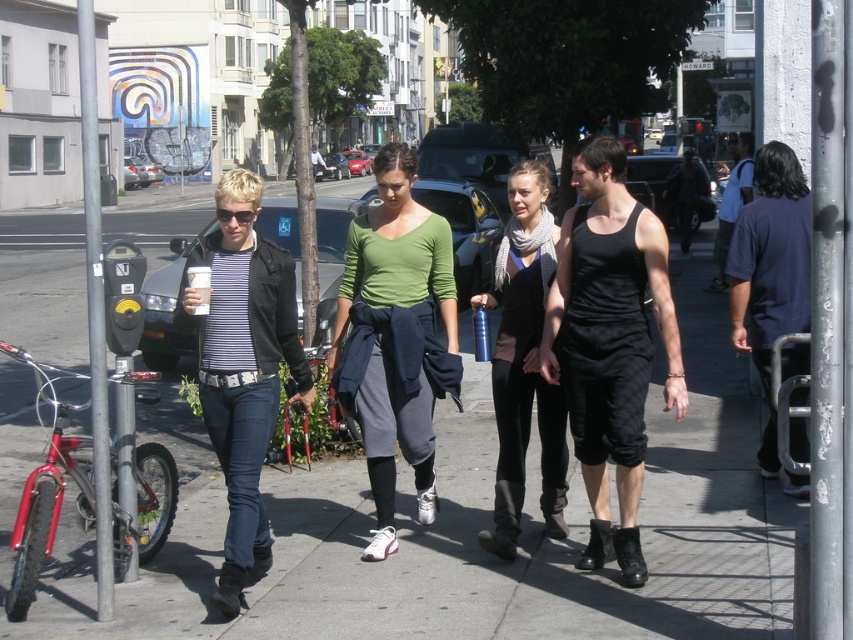
Is striped fabric shirt at left shorter than matte black vest at center?

Indeed, striped fabric shirt at left has a lesser height compared to matte black vest at center.

Is striped fabric shirt at left thinner than matte black vest at center?

Indeed, striped fabric shirt at left has a lesser width compared to matte black vest at center.

Who is more distant from viewer, (200, 260) or (543, 504)?

The point (543, 504) is behind.

Image resolution: width=853 pixels, height=640 pixels. Find the location of `striped fabric shirt at left`. striped fabric shirt at left is located at coordinates (242, 365).

Is black cotton tank top at center thinner than black tank top at center?

Yes, black cotton tank top at center is thinner than black tank top at center.

Is black cotton tank top at center below black tank top at center?

Yes.

The height and width of the screenshot is (640, 853). Find the location of `black cotton tank top at center`. black cotton tank top at center is located at coordinates (608, 342).

Can you confirm if gray concrete sidewalk at center is positioned above black tank top at center?

Actually, gray concrete sidewalk at center is below black tank top at center.

Does gray concrete sidewalk at center have a smaller size compared to black tank top at center?

Actually, gray concrete sidewalk at center might be larger than black tank top at center.

I want to click on gray concrete sidewalk at center, so click(x=469, y=529).

You are a GUI agent. You are given a task and a screenshot of the screen. Output one action in this format:
    pyautogui.click(x=<x>, y=<y>)
    Task: Click on the gray concrete sidewalk at center
    
    Given the screenshot: What is the action you would take?
    pyautogui.click(x=469, y=529)